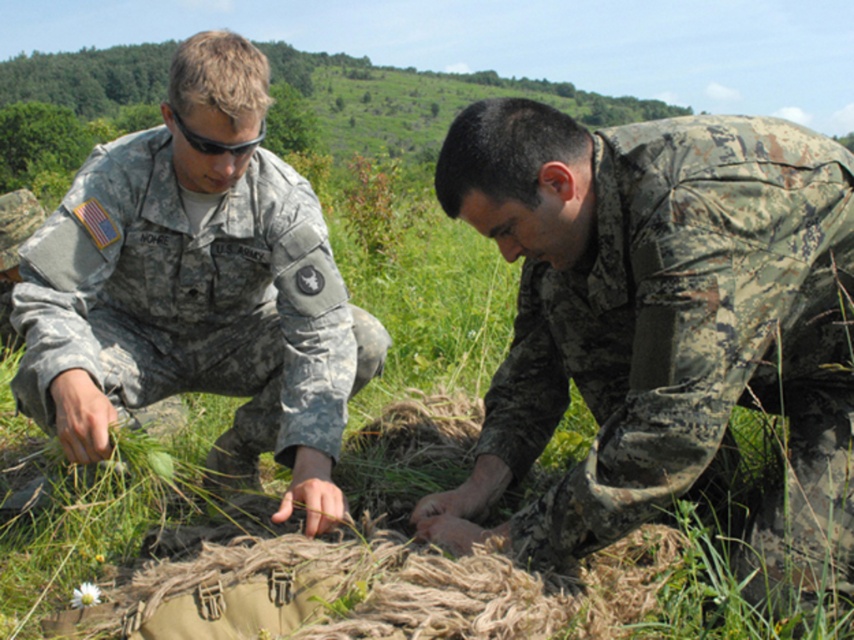
The image size is (854, 640). In order to click on camouflage fabric at center in this screenshot , I will do `click(659, 323)`.

I want to click on camouflage fabric at center, so click(659, 323).

Does camouflage fabric at center have a lesser height compared to black matte sunglasses at upper center?

In fact, camouflage fabric at center may be taller than black matte sunglasses at upper center.

Is camouflage fabric at center positioned in front of black matte sunglasses at upper center?

Yes, camouflage fabric at center is closer to the viewer.

Describe the element at coordinates (659, 323) in the screenshot. The image size is (854, 640). I see `camouflage fabric at center` at that location.

Identify the location of camouflage fabric at center. The image size is (854, 640). (659, 323).

Between camouflage uniform at left and black matte sunglasses at upper center, which one has less height?

With less height is black matte sunglasses at upper center.

Does camouflage uniform at left have a smaller size compared to black matte sunglasses at upper center?

No, camouflage uniform at left is not smaller than black matte sunglasses at upper center.

Between point (186, 44) and point (202, 147), which one is positioned behind?

The point (202, 147) is more distant.

Find the location of `camouflage uniform at left`. camouflage uniform at left is located at coordinates (196, 289).